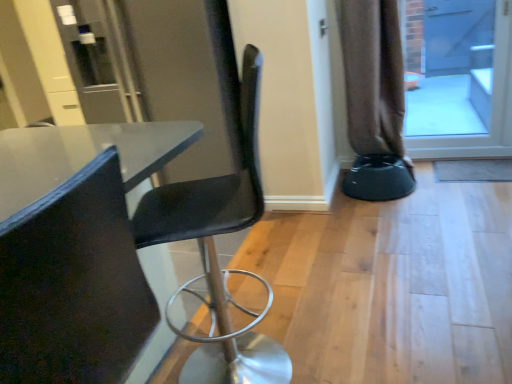
Question: Can you confirm if brown fabric curtain at right is shorter than black plastic bar stool at lower right?

Choices:
 (A) no
 (B) yes

Answer: (A)

Question: From the image's perspective, is brown fabric curtain at right located above black plastic bar stool at lower right?

Choices:
 (A) no
 (B) yes

Answer: (B)

Question: From a real-world perspective, does brown fabric curtain at right stand above black plastic bar stool at lower right?

Choices:
 (A) no
 (B) yes

Answer: (B)

Question: From the image's perspective, is brown fabric curtain at right under black plastic bar stool at lower right?

Choices:
 (A) no
 (B) yes

Answer: (A)

Question: Does brown fabric curtain at right appear on the right side of black plastic bar stool at lower right?

Choices:
 (A) no
 (B) yes

Answer: (A)

Question: Does brown fabric curtain at right have a greater height compared to black plastic bar stool at lower right?

Choices:
 (A) yes
 (B) no

Answer: (A)

Question: From the image's perspective, is black plastic bar stool at lower right above blue glass screen door at upper right?

Choices:
 (A) no
 (B) yes

Answer: (A)

Question: From a real-world perspective, is black plastic bar stool at lower right below blue glass screen door at upper right?

Choices:
 (A) no
 (B) yes

Answer: (B)

Question: Is black plastic bar stool at lower right touching blue glass screen door at upper right?

Choices:
 (A) no
 (B) yes

Answer: (A)

Question: From a real-world perspective, is black plastic bar stool at lower right located higher than blue glass screen door at upper right?

Choices:
 (A) no
 (B) yes

Answer: (A)

Question: Is the position of black plastic bar stool at lower right less distant than that of blue glass screen door at upper right?

Choices:
 (A) no
 (B) yes

Answer: (B)

Question: Is black plastic bar stool at lower right oriented away from blue glass screen door at upper right?

Choices:
 (A) no
 (B) yes

Answer: (A)

Question: Could brown fabric curtain at right be considered to be inside blue glass screen door at upper right?

Choices:
 (A) yes
 (B) no

Answer: (B)